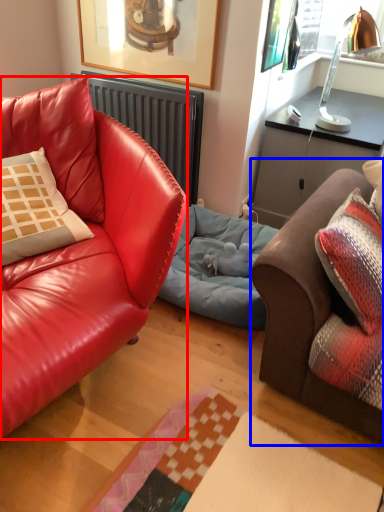
Question: Which object appears farthest to the camera in this image, studio couch (highlighted by a red box) or studio couch (highlighted by a blue box)?

Choices:
 (A) studio couch
 (B) studio couch

Answer: (B)